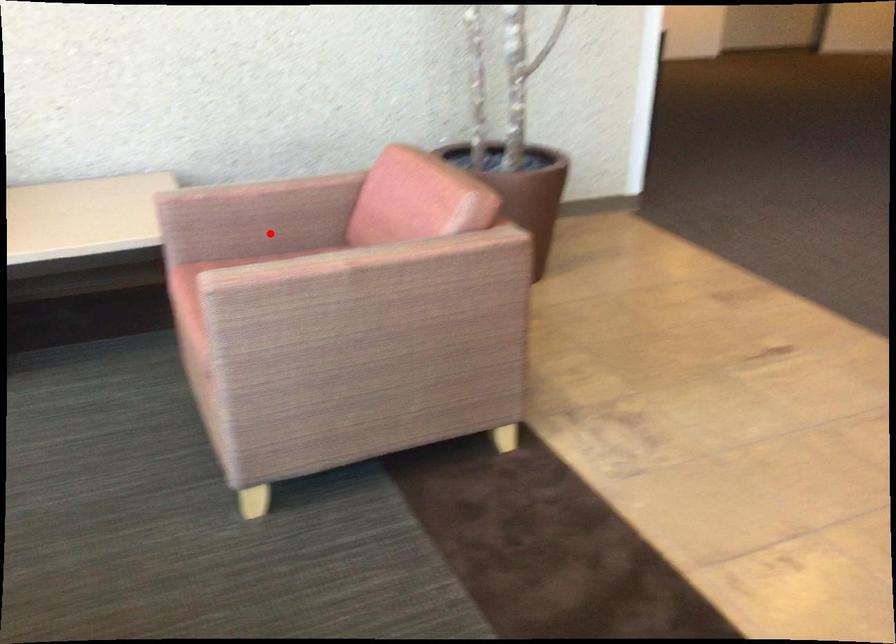
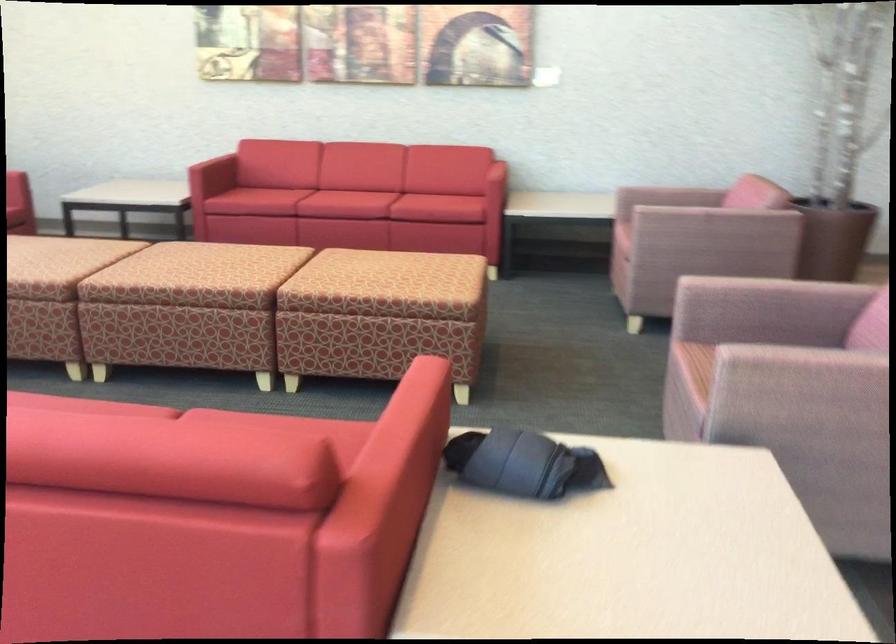
Find the pixel in the second image that matches the highlighted location in the first image.

(669, 196)